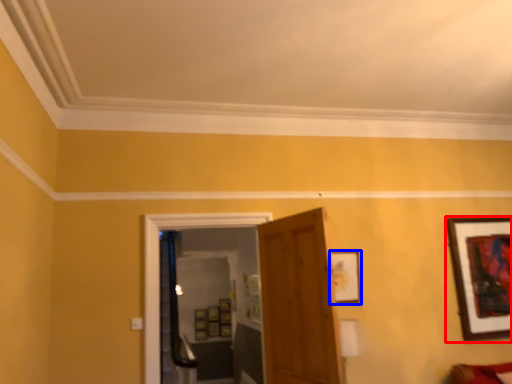
Question: Which object is further to the camera taking this photo, picture frame (highlighted by a red box) or picture frame (highlighted by a blue box)?

Choices:
 (A) picture frame
 (B) picture frame

Answer: (A)